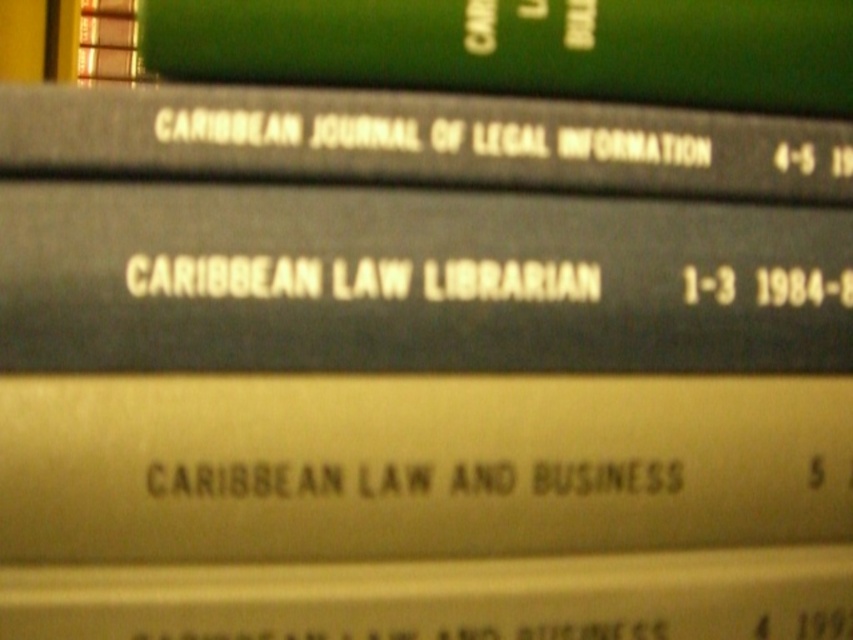
What is the title of the book at point (415, 465)?

The book at point (415, 465) is the matte gold book at center titled CARIBBEAN LAW AND BUSINESS.

You are looking at the stack of books from the front. There are two points marked on the books. One is at point [196,138] and the other is at point [419,67]. Which point is closer to you?

The point at [196,138] is closer to the viewer than the point at [419,67].

You are organizing a library shelf and need to place two books. The matte gold book at center and the green matte book at upper center. According to the image, which book should be placed on top to maintain the correct stacking order?

The green matte book at upper center should be placed on top because the matte gold book at center is below it in the stack.